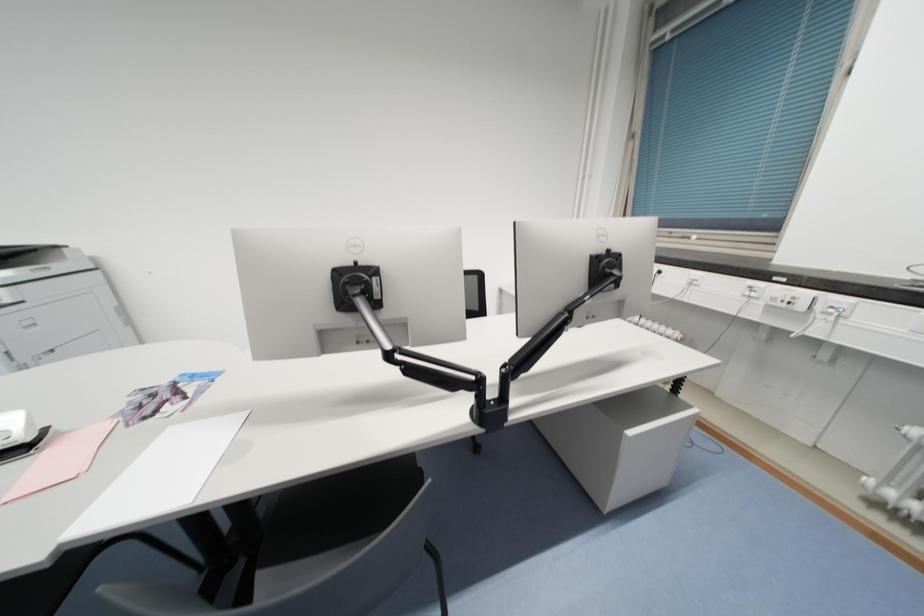
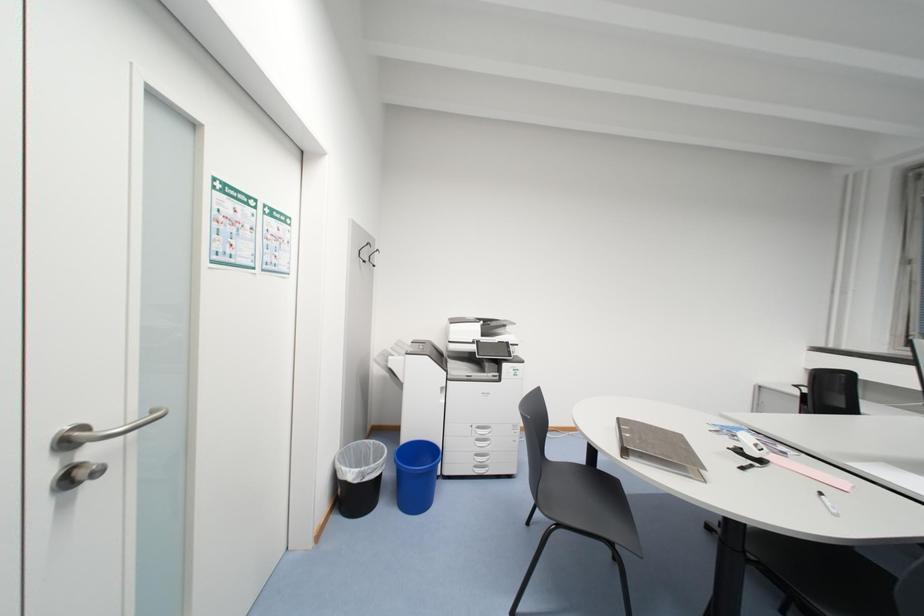
Question: In a continuous first-person perspective shot, in which direction is the camera moving?

Choices:
 (A) Left
 (B) Right
 (C) Forward
 (D) Backward

Answer: (A)